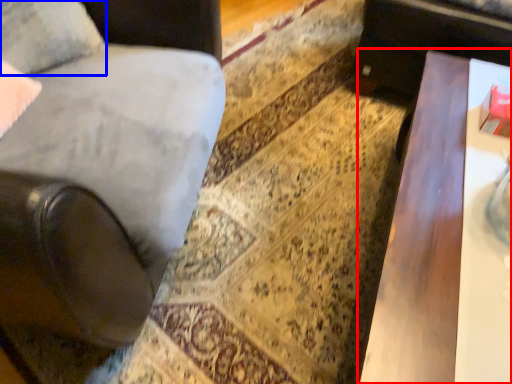
Question: Which point is closer to the camera, table (highlighted by a red box) or pillow (highlighted by a blue box)?

Choices:
 (A) table
 (B) pillow

Answer: (A)